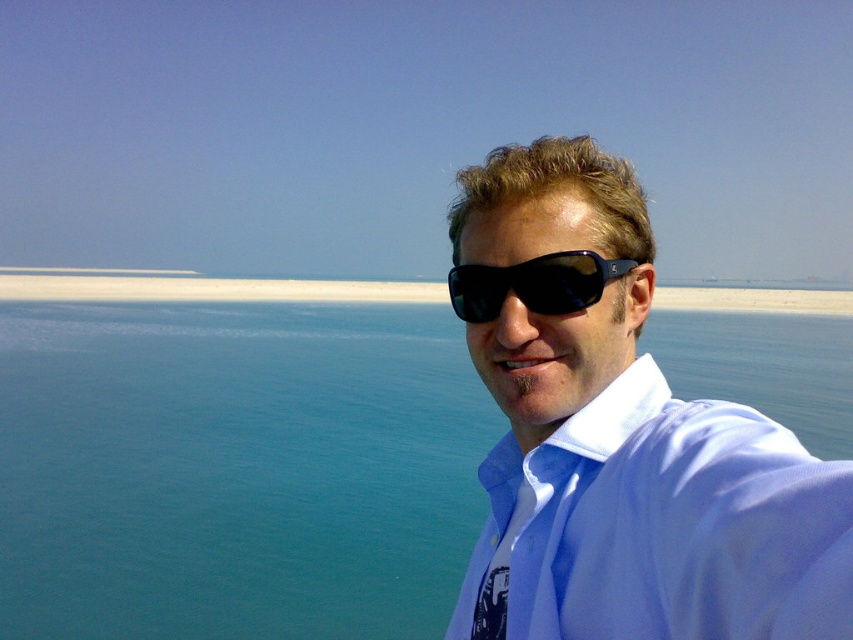
Question: Does blue water at center appear under matte black sunglasses at upper right?

Choices:
 (A) no
 (B) yes

Answer: (B)

Question: Estimate the real-world distances between objects in this image. Which object is closer to the blue water at center?

Choices:
 (A) matte black sunglasses at upper right
 (B) black plastic sunglasses at center

Answer: (A)

Question: Which object is positioned closest to the blue water at center?

Choices:
 (A) black plastic sunglasses at center
 (B) matte black sunglasses at upper right

Answer: (B)

Question: From the image, what is the correct spatial relationship of blue water at center in relation to matte black sunglasses at upper right?

Choices:
 (A) below
 (B) above

Answer: (A)

Question: Does blue water at center appear on the right side of black plastic sunglasses at center?

Choices:
 (A) yes
 (B) no

Answer: (A)

Question: Which object appears closest to the camera in this image?

Choices:
 (A) matte black sunglasses at upper right
 (B) black plastic sunglasses at center
 (C) blue water at center

Answer: (A)